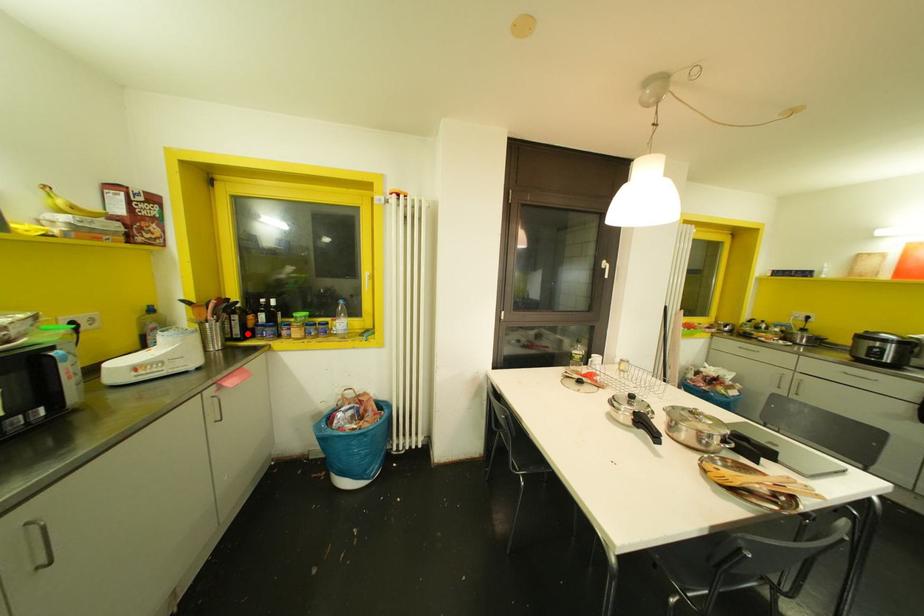
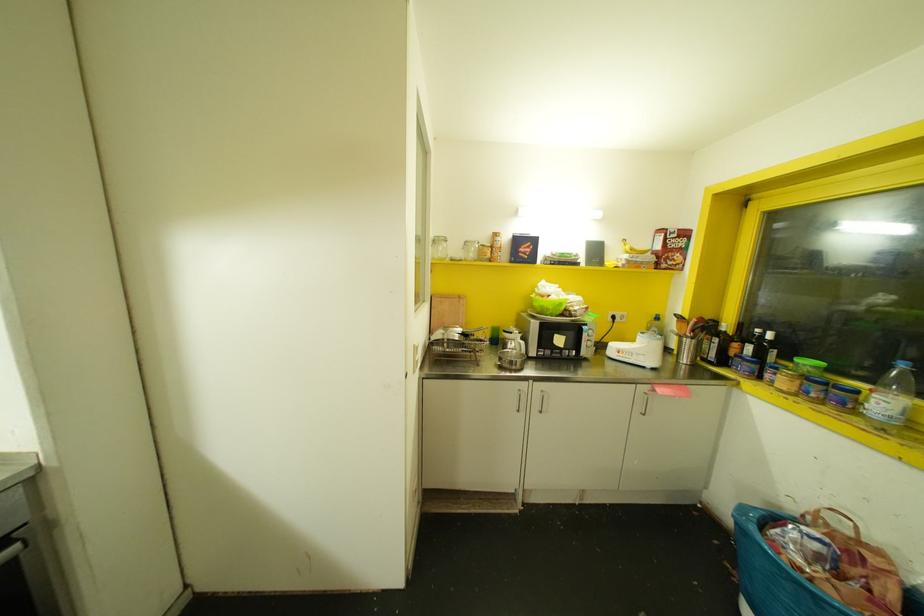
Find the pixel in the second image that matches the highlighted location in the first image.

(723, 361)